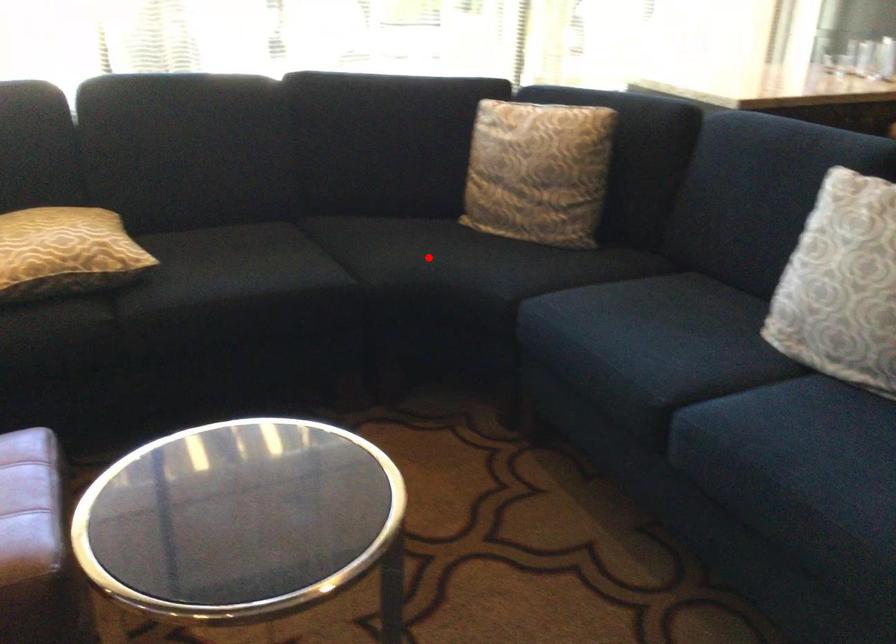
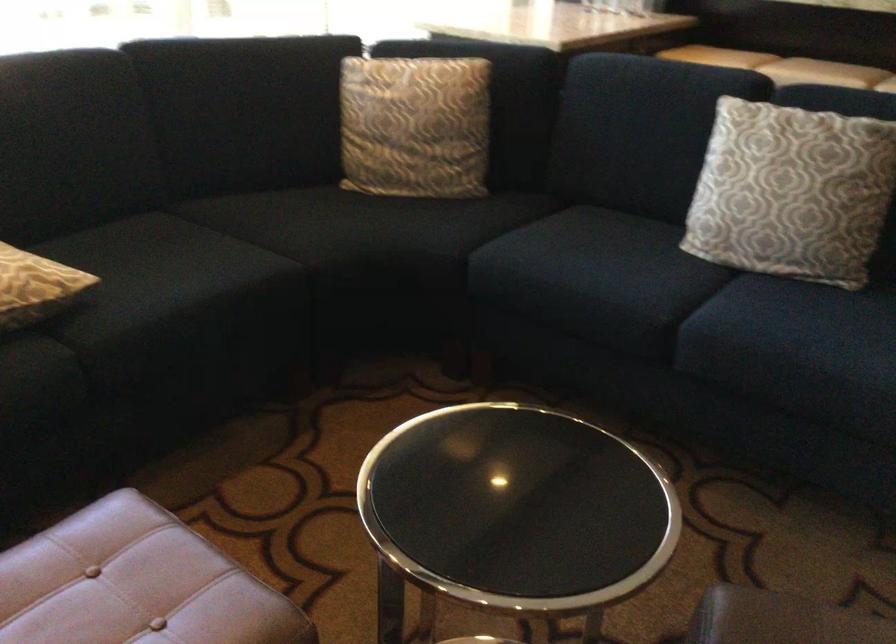
In the second image, find the point that corresponds to the highlighted location in the first image.

(348, 227)